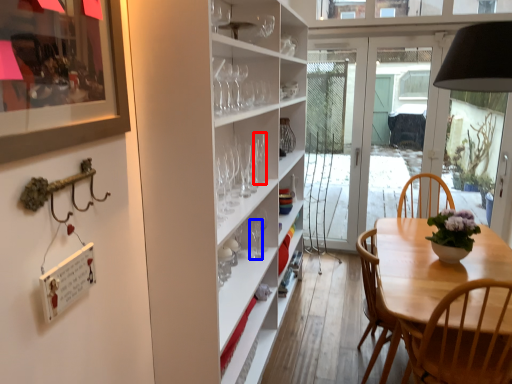
Question: Which of the following is the farthest to the observer, wine glass (highlighted by a red box) or wine glass (highlighted by a blue box)?

Choices:
 (A) wine glass
 (B) wine glass

Answer: (A)